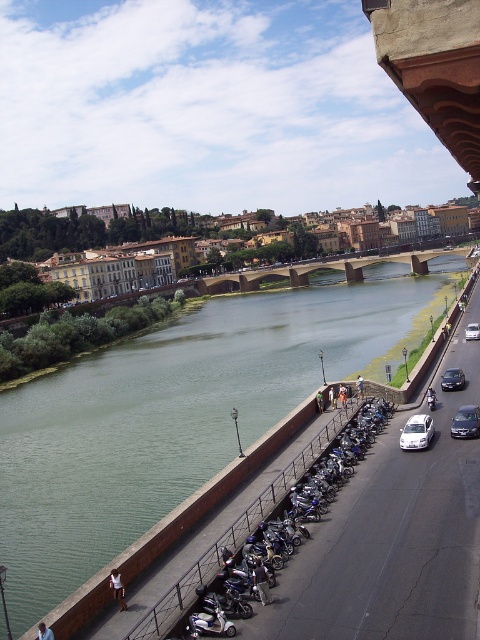
Does white matte car at right have a smaller size compared to shiny black sedan at right?

Actually, white matte car at right might be larger than shiny black sedan at right.

Who is higher up, white matte car at right or shiny black sedan at right?

Positioned higher is shiny black sedan at right.

This screenshot has height=640, width=480. What are the coordinates of `white matte car at right` in the screenshot? It's located at (417, 433).

Is shiny silver sedan at right wider than white glossy car at center-right?

In fact, shiny silver sedan at right might be narrower than white glossy car at center-right.

Can you confirm if shiny silver sedan at right is taller than white glossy car at center-right?

No, shiny silver sedan at right is not taller than white glossy car at center-right.

Is point (457, 433) positioned behind point (470, 333)?

No, (457, 433) is closer to viewer.

The height and width of the screenshot is (640, 480). Identify the location of shiny silver sedan at right. (466, 420).

Is brown stone bridge at center bigger than shiny silver sedan at right?

Correct, brown stone bridge at center is larger in size than shiny silver sedan at right.

Can you confirm if brown stone bridge at center is positioned above shiny silver sedan at right?

Yes, brown stone bridge at center is above shiny silver sedan at right.

Is point (347, 260) positioned behind point (465, 416)?

Yes, point (347, 260) is behind point (465, 416).

Identify the location of brown stone bridge at center. The width and height of the screenshot is (480, 640). (321, 269).